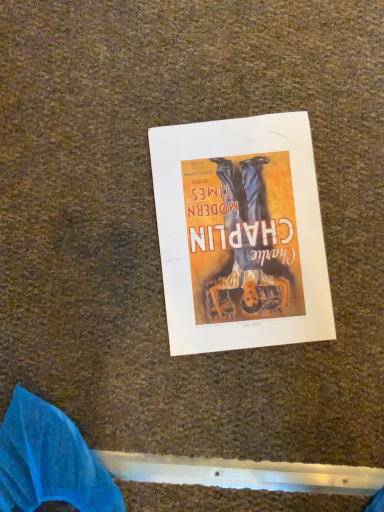
You are a GUI agent. You are given a task and a screenshot of the screen. Output one action in this format:
    pyautogui.click(x=<x>, y=<y>)
    Task: Click on the blank space situated above white paper poster at center (from a real-world perspective)
    Image resolution: width=384 pixels, height=512 pixels.
    Given the screenshot: What is the action you would take?
    pyautogui.click(x=243, y=227)